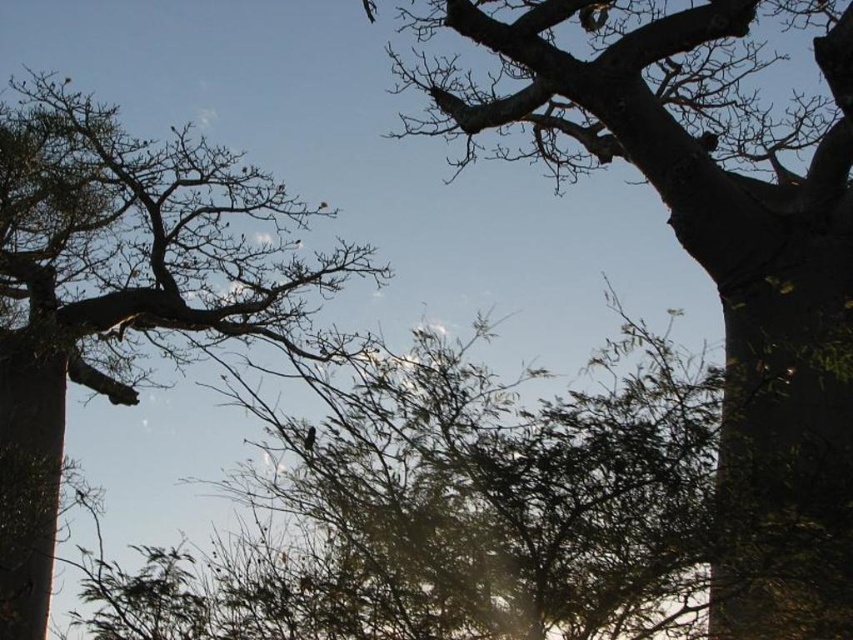
You are standing at the base of the central tree with dense foliage and looking upwards. There are two points marked in the image. One is at coordinate point (845, 536) and the other at point (219, 163). Which point is closer to your viewpoint?

Point (845, 536) is closer to your viewpoint because it is in front of point (219, 163).

You are a bird looking for a nesting spot. You see the rough bark tree at upper right and the smooth bark tree at left. Which tree is taller and better for nesting?

The smooth bark tree at left is taller than the rough bark tree at upper right, so it would be better for nesting.

You are standing at the center of the scene and want to locate the rough bark tree at upper right. Based on the coordinates provided, in which direction should you look to find it?

The rough bark tree at upper right is located at point 0.398 on the x axis and 0.835 on the y axis. Since the coordinates are given as x,y, the upper right would be in the northeast direction from your current position at the center.